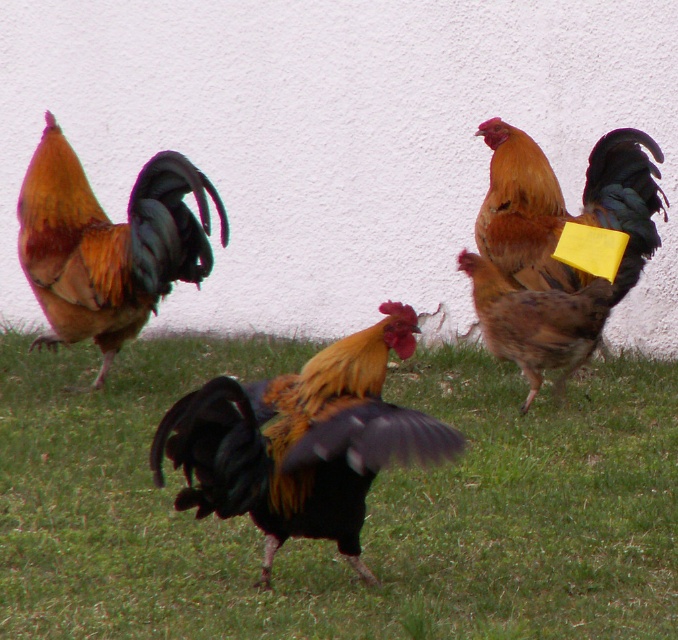
Is green grass at center further to camera compared to shiny orange feathers at left?

That is False.

Is green grass at center bigger than shiny orange feathers at left?

Indeed, green grass at center has a larger size compared to shiny orange feathers at left.

Who is more forward, [506,458] or [41,339]?

Point [506,458] is more forward.

Find the location of a particular element. The height and width of the screenshot is (640, 678). green grass at center is located at coordinates (365, 513).

Can you confirm if shiny black rooster at center is positioned above golden brown feathers at center?

No, shiny black rooster at center is not above golden brown feathers at center.

Which is more to the left, shiny black rooster at center or golden brown feathers at center?

shiny black rooster at center

Is point (315, 440) positioned in front of point (633, 237)?

Yes, it is.

The image size is (678, 640). What are the coordinates of `shiny black rooster at center` in the screenshot? It's located at (302, 442).

Is shiny black rooster at center further to camera compared to shiny orange feathers at left?

No.

Can you confirm if shiny black rooster at center is wider than shiny orange feathers at left?

In fact, shiny black rooster at center might be narrower than shiny orange feathers at left.

What do you see at coordinates (302, 442) in the screenshot? I see `shiny black rooster at center` at bounding box center [302, 442].

Locate an element on the screen. shiny black rooster at center is located at coordinates (302, 442).